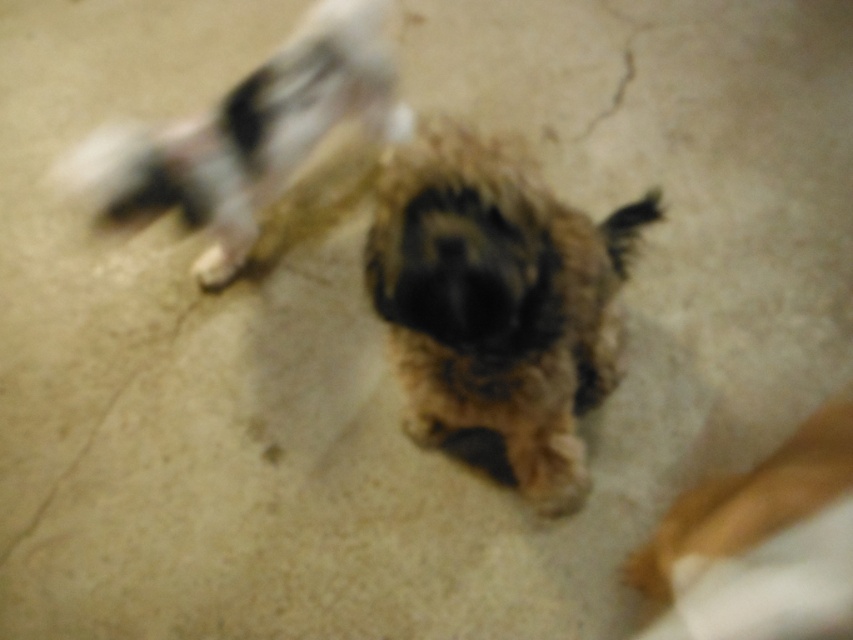
Is fuzzy brown dog at center shorter than fuzzy brown paw at center?

Incorrect, fuzzy brown dog at center's height does not fall short of fuzzy brown paw at center's.

Who is positioned more to the right, fuzzy brown dog at center or fuzzy brown paw at center?

fuzzy brown dog at center

You are a GUI agent. You are given a task and a screenshot of the screen. Output one action in this format:
    pyautogui.click(x=<x>, y=<y>)
    Task: Click on the fuzzy brown dog at center
    
    Given the screenshot: What is the action you would take?
    pyautogui.click(x=498, y=304)

Who is positioned more to the right, fluffy brown dog at upper left or fuzzy brown paw at center?

From the viewer's perspective, fluffy brown dog at upper left appears more on the right side.

Is point (86, 188) less distant than point (225, 284)?

No, (86, 188) is behind (225, 284).

Where is `fluffy brown dog at upper left`? This screenshot has height=640, width=853. fluffy brown dog at upper left is located at coordinates (248, 129).

Is fuzzy brown dog at center taller than brown fuzzy dog at center?

Yes, fuzzy brown dog at center is taller than brown fuzzy dog at center.

What do you see at coordinates (498, 304) in the screenshot? I see `fuzzy brown dog at center` at bounding box center [498, 304].

What are the coordinates of `fuzzy brown dog at center` in the screenshot? It's located at (498, 304).